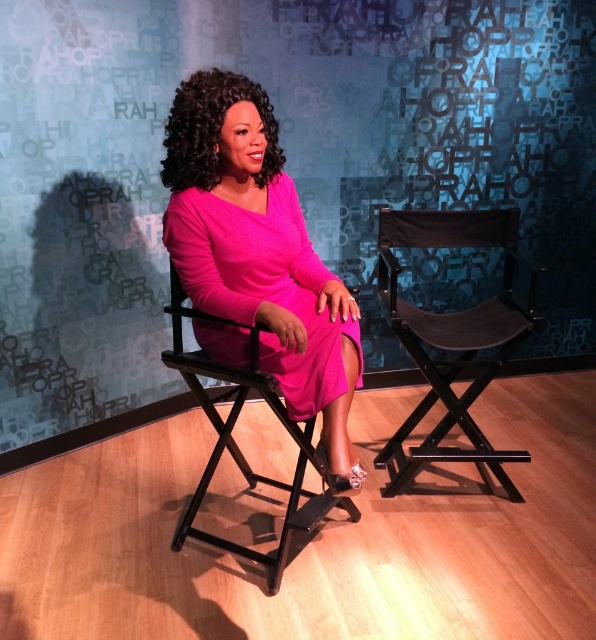
Is textured fabric backdrop at upper center further to camera compared to black fabric director's chair at right?

Yes, textured fabric backdrop at upper center is behind black fabric director's chair at right.

Is textured fabric backdrop at upper center closer to the viewer compared to black fabric director's chair at right?

That is False.

Image resolution: width=596 pixels, height=640 pixels. Describe the element at coordinates (287, 168) in the screenshot. I see `textured fabric backdrop at upper center` at that location.

I want to click on textured fabric backdrop at upper center, so click(x=287, y=168).

Can you confirm if black fabric director's chair at right is wider than matte black director's chair at center?

In fact, black fabric director's chair at right might be narrower than matte black director's chair at center.

Does black fabric director's chair at right have a greater height compared to matte black director's chair at center?

Indeed, black fabric director's chair at right has a greater height compared to matte black director's chair at center.

Is point (430, 364) closer to viewer compared to point (305, 422)?

No.

This screenshot has height=640, width=596. Identify the location of black fabric director's chair at right. (452, 339).

Does pink satin dress at center have a smaller size compared to black fabric director's chair at right?

Correct, pink satin dress at center occupies less space than black fabric director's chair at right.

The width and height of the screenshot is (596, 640). Identify the location of pink satin dress at center. (262, 284).